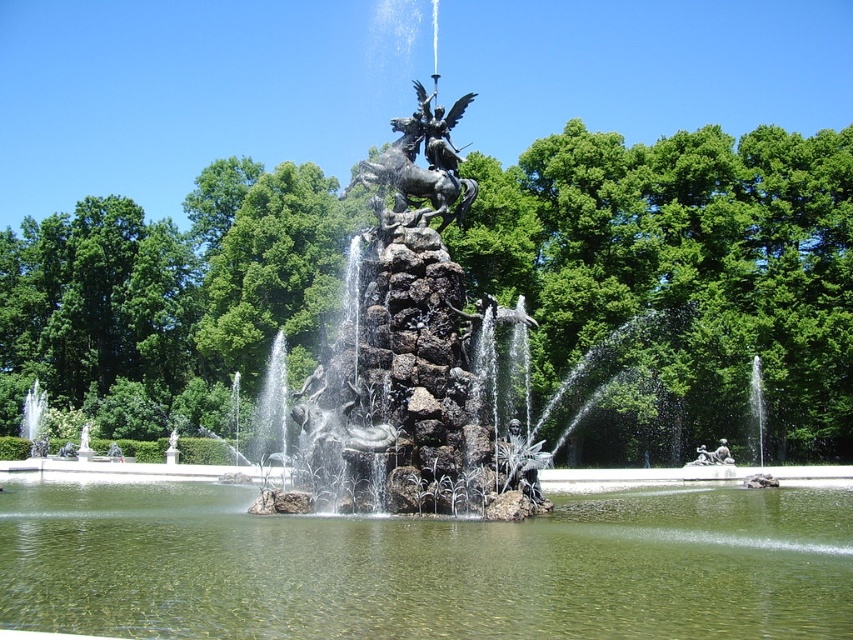
Which of these two, green stone lake at center or polished bronze statue at upper center, stands taller?

polished bronze statue at upper center

Does point (68, 492) come behind point (398, 140)?

That is True.

You are a GUI agent. You are given a task and a screenshot of the screen. Output one action in this format:
    pyautogui.click(x=<x>, y=<y>)
    Task: Click on the green stone lake at center
    
    Given the screenshot: What is the action you would take?
    pyautogui.click(x=426, y=566)